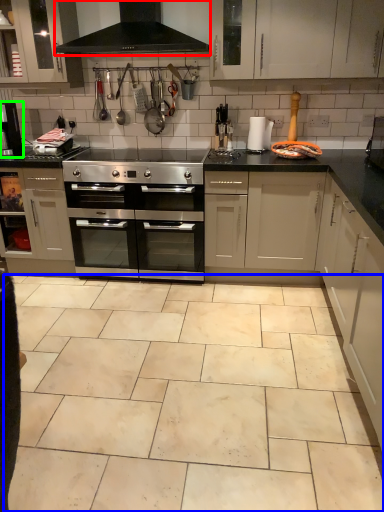
Question: Which is nearer to the exhaust hood (highlighted by a red box)? ceramic tile (highlighted by a blue box) or coffee machine (highlighted by a green box).

Choices:
 (A) ceramic tile
 (B) coffee machine

Answer: (B)